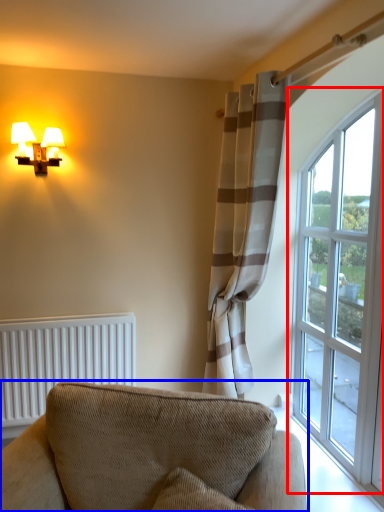
Question: Among these objects, which one is farthest to the camera, window (highlighted by a red box) or studio couch (highlighted by a blue box)?

Choices:
 (A) window
 (B) studio couch

Answer: (A)